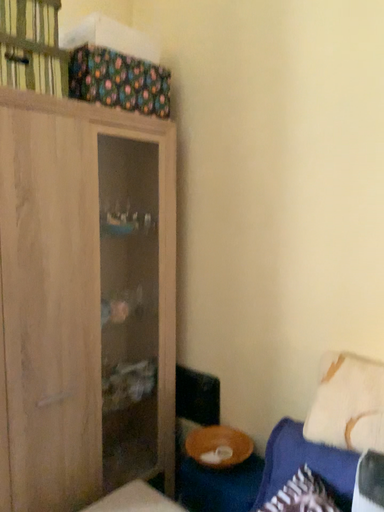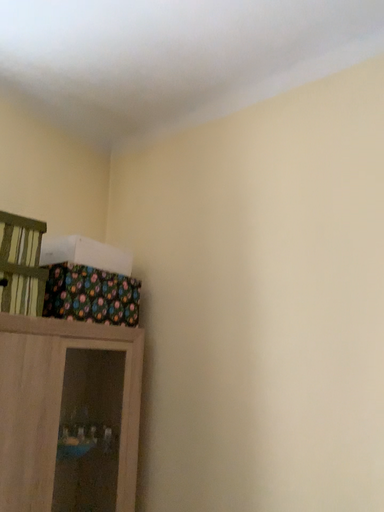
Question: How did the camera likely rotate when shooting the video?

Choices:
 (A) rotated downward
 (B) rotated upward

Answer: (B)